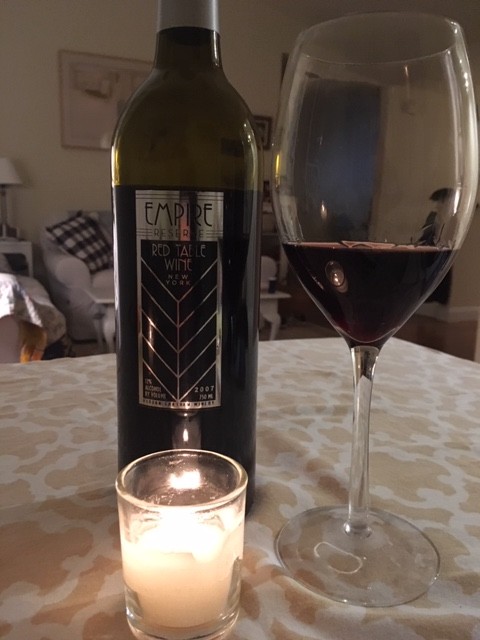
Identify the location of painting. (85, 113).